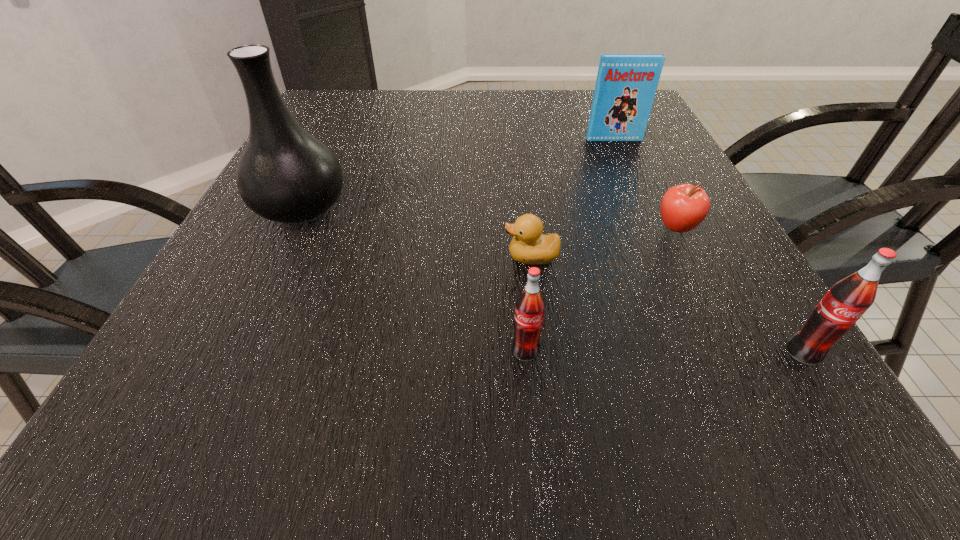
Where is `the shorter soda bottle`? This screenshot has height=540, width=960. the shorter soda bottle is located at coordinates pos(530,305).

At what (x,y) coordinates should I click in order to perform the action: click on the left soda bottle. Please return your answer as a coordinate pair (x, y). Looking at the image, I should click on (530, 305).

The image size is (960, 540). I want to click on the rightmost object, so click(x=846, y=301).

The image size is (960, 540). Find the location of `the taller soda bottle`. the taller soda bottle is located at coordinates (846, 301).

The image size is (960, 540). What are the coordinates of `the leftmost object` in the screenshot? It's located at [285, 174].

I want to click on the tallest object, so click(285, 174).

This screenshot has height=540, width=960. Identify the location of book. (626, 84).

Where is `duckling`? This screenshot has height=540, width=960. duckling is located at coordinates (529, 246).

Where is `apple`? The height and width of the screenshot is (540, 960). apple is located at coordinates (683, 207).

In order to click on vacant point located on the right of the tallest object in this screenshot , I will do `click(463, 206)`.